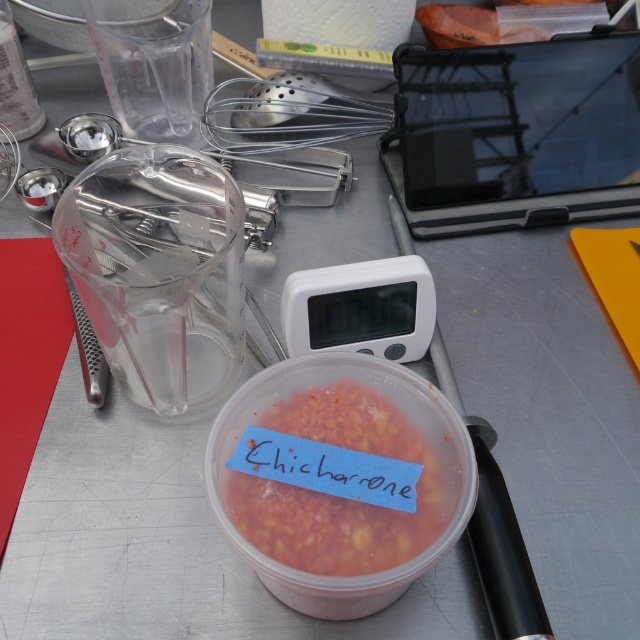
Question: Which object is farther from the camera taking this photo?

Choices:
 (A) translucent plastic container at center
 (B) transparent plastic blender at center-left

Answer: (B)

Question: Does transparent plastic blender at center-left lie in front of translucent plastic container at center?

Choices:
 (A) yes
 (B) no

Answer: (B)

Question: Which of the following is the farthest from the observer?

Choices:
 (A) translucent plastic container at center
 (B) transparent plastic blender at center-left

Answer: (B)

Question: Which object appears closest to the camera in this image?

Choices:
 (A) transparent plastic blender at center-left
 (B) translucent plastic container at center

Answer: (B)

Question: Is transparent plastic blender at center-left further to the viewer compared to translucent plastic container at center?

Choices:
 (A) no
 (B) yes

Answer: (B)

Question: Is transparent plastic blender at center-left above translucent plastic container at center?

Choices:
 (A) yes
 (B) no

Answer: (A)